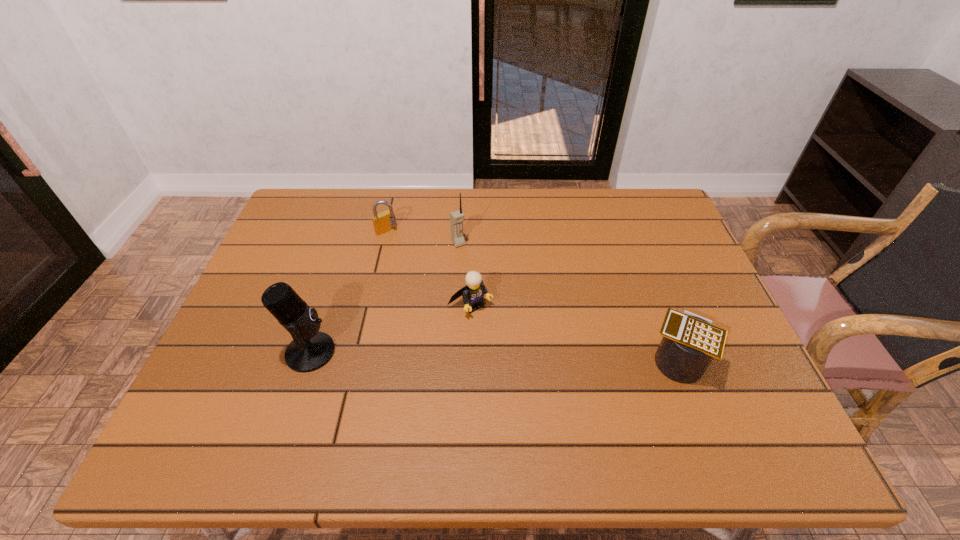
You are a GUI agent. You are given a task and a screenshot of the screen. Output one action in this format:
    pyautogui.click(x=<x>, y=<y>)
    Task: Click on the free space on the desktop that is between the tallest object and the calculator and is positioned on the side with the combination dials of the second object from left to right
    The width and height of the screenshot is (960, 540).
    Given the screenshot: What is the action you would take?
    pyautogui.click(x=523, y=356)

The width and height of the screenshot is (960, 540). In order to click on vacant spot on the desktop that is between the tallest object and the calculator and is positioned on the front of the second farthest object, where the keypad is located in this screenshot , I will do `click(538, 357)`.

I want to click on free spot on the desktop that is between the leftmost object and the calculator and is positioned on the front-facing side of the Lego, so [x=521, y=356].